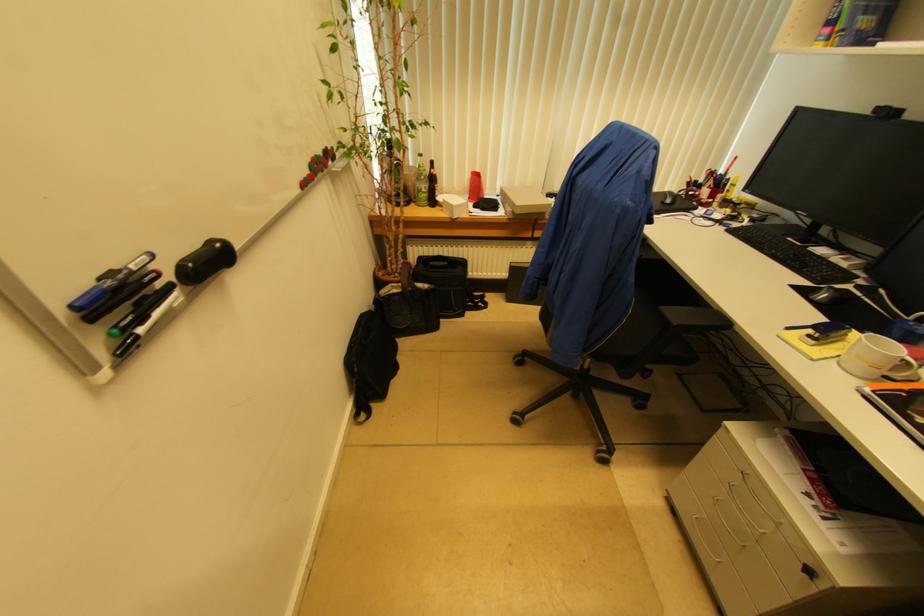
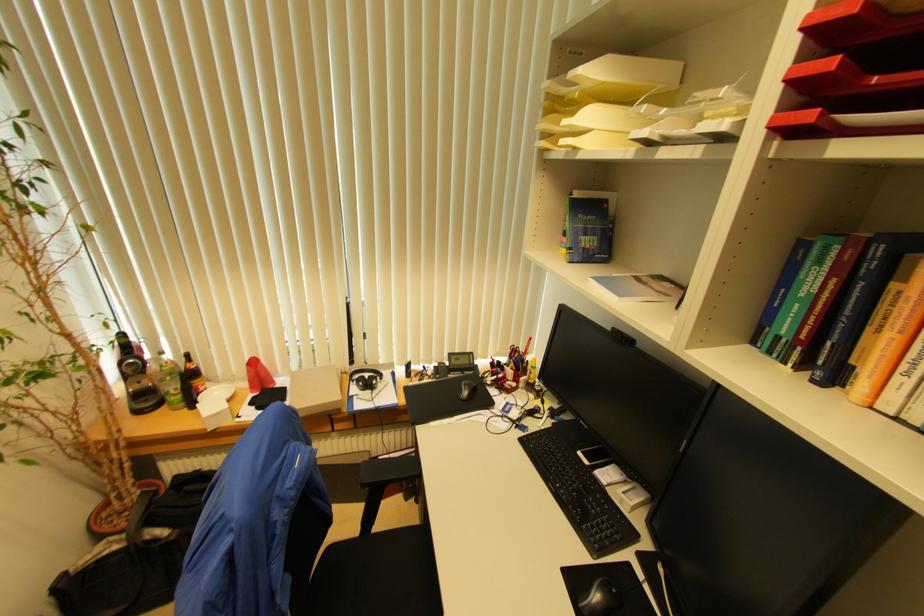
In the second image, find the point that corresponds to (433,164) in the first image.

(188, 358)